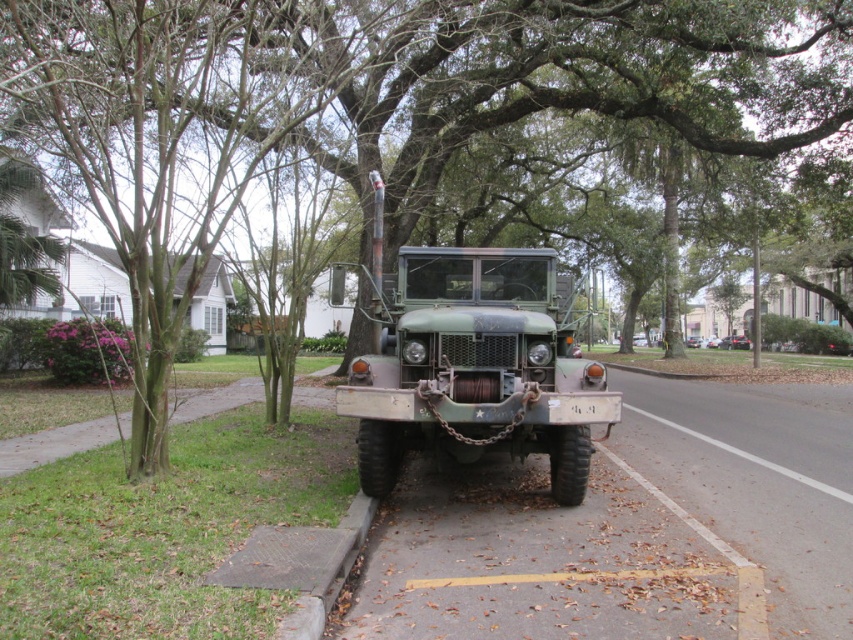
Question: Can you confirm if green matte truck at center is positioned to the left of matte green truck at center?

Choices:
 (A) no
 (B) yes

Answer: (B)

Question: Which point is closer to the camera?

Choices:
 (A) (416, 272)
 (B) (732, 339)

Answer: (A)

Question: Which point is closer to the camera?

Choices:
 (A) green matte truck at center
 (B) matte green truck at center

Answer: (A)

Question: Can you confirm if green matte truck at center is positioned to the left of matte green truck at center?

Choices:
 (A) no
 (B) yes

Answer: (B)

Question: Is green matte truck at center wider than matte green truck at center?

Choices:
 (A) no
 (B) yes

Answer: (A)